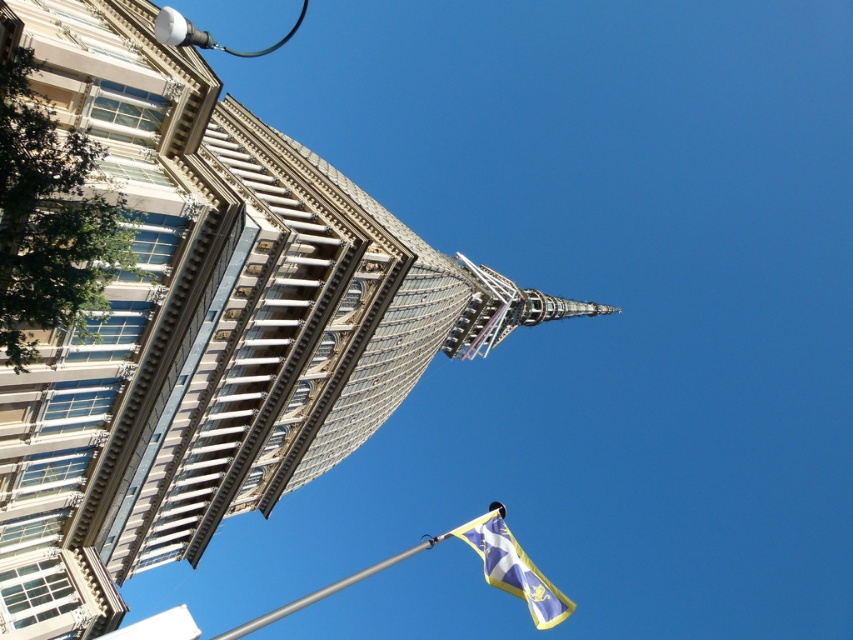
Does blue and yellow fabric flag at lower center have a lesser height compared to silver metallic flag pole at lower center?

Yes.

Can you confirm if blue and yellow fabric flag at lower center is bigger than silver metallic flag pole at lower center?

Incorrect, blue and yellow fabric flag at lower center is not larger than silver metallic flag pole at lower center.

This screenshot has width=853, height=640. I want to click on blue and yellow fabric flag at lower center, so click(514, 568).

The height and width of the screenshot is (640, 853). In order to click on blue and yellow fabric flag at lower center in this screenshot , I will do `click(514, 568)`.

Where is `glassy gray dome at upper center`? glassy gray dome at upper center is located at coordinates (207, 326).

Is glassy gray dome at upper center positioned before blue and yellow fabric flag at lower center?

No, it is not.

Is point (231, 198) positioned after point (483, 570)?

No, it is not.

The image size is (853, 640). I want to click on glassy gray dome at upper center, so click(x=207, y=326).

Does glassy gray dome at upper center have a smaller size compared to white glossy streetlight at upper left?

Yes, glassy gray dome at upper center is smaller than white glossy streetlight at upper left.

What do you see at coordinates (207, 326) in the screenshot? This screenshot has width=853, height=640. I see `glassy gray dome at upper center` at bounding box center [207, 326].

The image size is (853, 640). I want to click on glassy gray dome at upper center, so click(207, 326).